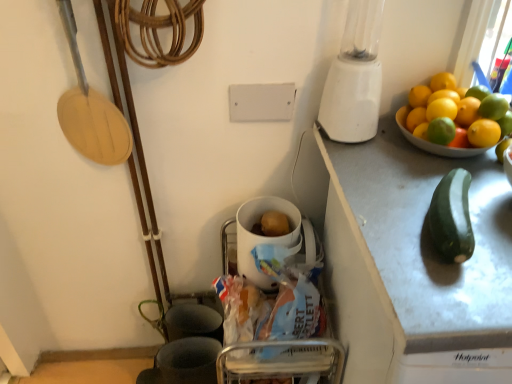
Question: Looking at the image, does yellow matte lemon at upper right, acting as the 4th lemon starting from the bottom, seem bigger or smaller compared to yellow matte lemon at upper right, the sixth lemon positioned from the bottom?

Choices:
 (A) small
 (B) big

Answer: (A)

Question: Is yellow matte lemon at upper right, acting as the 4th lemon starting from the bottom, spatially inside yellow matte lemon at upper right, arranged as the first lemon when viewed from the top, or outside of it?

Choices:
 (A) inside
 (B) outside

Answer: (B)

Question: Which of these objects is positioned farthest from the yellow matte lemon at upper right, which is counted as the 5th lemon, starting from the bottom?

Choices:
 (A) white plastic blender at upper right
 (B) yellow matte lemon at upper right, the fourth lemon when ordered from top to bottom
 (C) white glossy mug at center
 (D) orange matte at upper right
 (E) wooden at left

Answer: (E)

Question: Which object is positioned closest to the yellow matte lemon at upper right, which is the second lemon from top to bottom?

Choices:
 (A) green matte zucchini at right
 (B) white glossy mug at center
 (C) yellow matte lemon at upper right, arranged as the first lemon when viewed from the top
 (D) yellow matte lemon at right, the second lemon from the bottom
 (E) orange matte at upper right

Answer: (E)